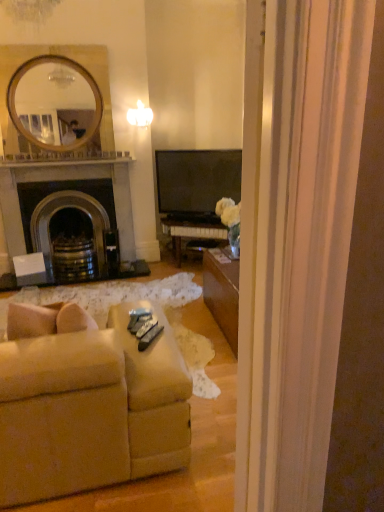
Question: Is dark gray stone fireplace at left bigger than beige fabric couch at lower left?

Choices:
 (A) yes
 (B) no

Answer: (B)

Question: Is dark gray stone fireplace at left behind beige fabric couch at lower left?

Choices:
 (A) no
 (B) yes

Answer: (B)

Question: Is dark gray stone fireplace at left smaller than beige fabric couch at lower left?

Choices:
 (A) no
 (B) yes

Answer: (B)

Question: Does dark gray stone fireplace at left appear on the right side of beige fabric couch at lower left?

Choices:
 (A) no
 (B) yes

Answer: (A)

Question: Would you consider dark gray stone fireplace at left to be distant from beige fabric couch at lower left?

Choices:
 (A) yes
 (B) no

Answer: (A)

Question: Considering the relative sizes of dark gray stone fireplace at left and beige fabric couch at lower left in the image provided, is dark gray stone fireplace at left shorter than beige fabric couch at lower left?

Choices:
 (A) no
 (B) yes

Answer: (A)

Question: Is beige fabric couch at lower left to the left of dark gray stone fireplace at left from the viewer's perspective?

Choices:
 (A) no
 (B) yes

Answer: (A)

Question: Does beige fabric couch at lower left have a lesser height compared to dark gray stone fireplace at left?

Choices:
 (A) no
 (B) yes

Answer: (B)

Question: Are beige fabric couch at lower left and dark gray stone fireplace at left located far from each other?

Choices:
 (A) no
 (B) yes

Answer: (B)

Question: Is beige fabric couch at lower left looking in the opposite direction of dark gray stone fireplace at left?

Choices:
 (A) no
 (B) yes

Answer: (A)

Question: Can you confirm if beige fabric couch at lower left is positioned to the right of dark gray stone fireplace at left?

Choices:
 (A) no
 (B) yes

Answer: (B)

Question: Is beige fabric couch at lower left with dark gray stone fireplace at left?

Choices:
 (A) yes
 (B) no

Answer: (B)

Question: Considering their positions, is beige fabric couch at lower left located in front of or behind dark gray stone fireplace at left?

Choices:
 (A) front
 (B) behind

Answer: (A)